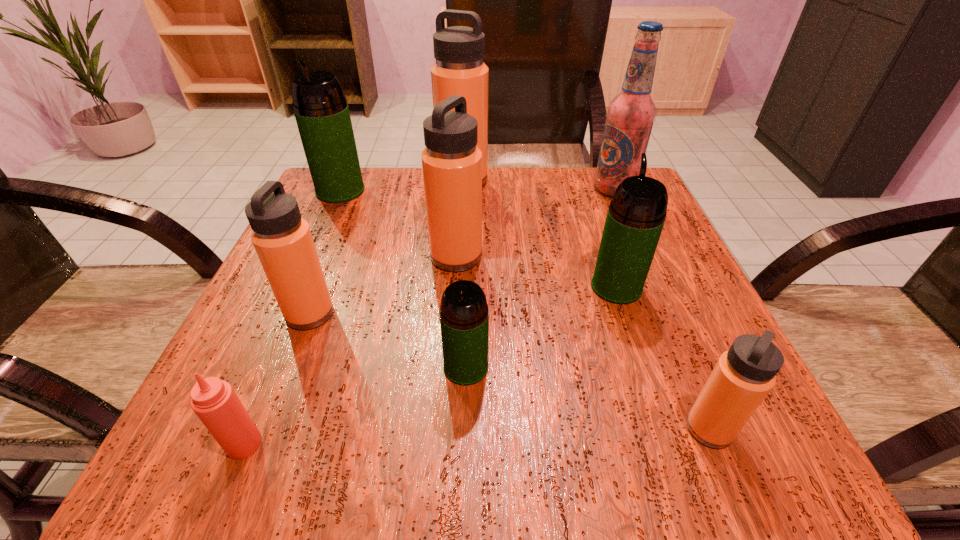
Image resolution: width=960 pixels, height=540 pixels. Find the location of `the farthest orange thermos bottle`. the farthest orange thermos bottle is located at coordinates (459, 70).

Find the location of a particular element. The image size is (960, 540). the tallest thermos bottle is located at coordinates (459, 70).

Locate an element on the screen. The width and height of the screenshot is (960, 540). alcohol is located at coordinates (630, 115).

Locate an element on the screen. This screenshot has height=540, width=960. the biggest green thermos bottle is located at coordinates (321, 111).

At what (x,y) coordinates should I click in order to perform the action: click on the leftmost green thermos bottle. Please return your answer as a coordinate pair (x, y). Looking at the image, I should click on (321, 111).

Where is `the third smallest orange thermos bottle`? the third smallest orange thermos bottle is located at coordinates (451, 162).

Image resolution: width=960 pixels, height=540 pixels. Find the location of `the rightmost green thermos bottle`. the rightmost green thermos bottle is located at coordinates (636, 215).

Find the location of `the second farthest green thermos bottle`. the second farthest green thermos bottle is located at coordinates (636, 215).

Find the location of `the leftmost orange thermos bottle`. the leftmost orange thermos bottle is located at coordinates (282, 239).

Find the location of `the second nearest orange thermos bottle`. the second nearest orange thermos bottle is located at coordinates (282, 239).